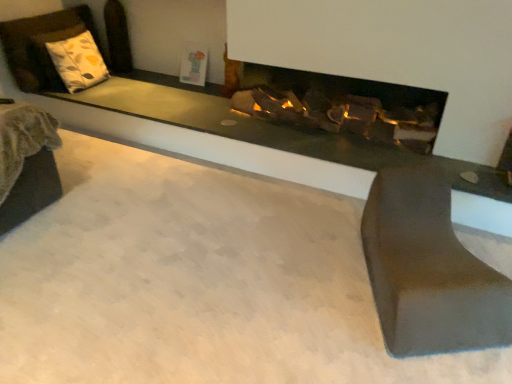
Question: Can we say white fabric pillow at upper left lies outside matte gray bench at lower right?

Choices:
 (A) yes
 (B) no

Answer: (A)

Question: Is white fabric pillow at upper left far from matte gray bench at lower right?

Choices:
 (A) yes
 (B) no

Answer: (A)

Question: Considering the relative sizes of white fabric pillow at upper left and matte gray bench at lower right in the image provided, is white fabric pillow at upper left bigger than matte gray bench at lower right?

Choices:
 (A) yes
 (B) no

Answer: (B)

Question: From a real-world perspective, is white fabric pillow at upper left positioned over matte gray bench at lower right based on gravity?

Choices:
 (A) no
 (B) yes

Answer: (B)

Question: Is matte gray bench at lower right completely or partially inside white fabric pillow at upper left?

Choices:
 (A) no
 (B) yes

Answer: (A)

Question: Can you confirm if white fabric pillow at upper left is shorter than matte gray bench at lower right?

Choices:
 (A) no
 (B) yes

Answer: (A)

Question: From the image's perspective, would you say matte gray bench at lower right is positioned over white fabric pillow at upper left?

Choices:
 (A) yes
 (B) no

Answer: (B)

Question: Does matte gray bench at lower right have a lesser width compared to white fabric pillow at upper left?

Choices:
 (A) yes
 (B) no

Answer: (B)

Question: Does matte gray bench at lower right have a lesser height compared to white fabric pillow at upper left?

Choices:
 (A) yes
 (B) no

Answer: (A)

Question: Does matte gray bench at lower right come behind white fabric pillow at upper left?

Choices:
 (A) no
 (B) yes

Answer: (A)

Question: Is matte gray bench at lower right surrounding white fabric pillow at upper left?

Choices:
 (A) no
 (B) yes

Answer: (A)

Question: From a real-world perspective, is matte gray bench at lower right below white fabric pillow at upper left?

Choices:
 (A) no
 (B) yes

Answer: (B)

Question: Looking at their shapes, would you say white fabric pillow at upper left is wider or thinner than matte gray bench at lower right?

Choices:
 (A) thin
 (B) wide

Answer: (A)